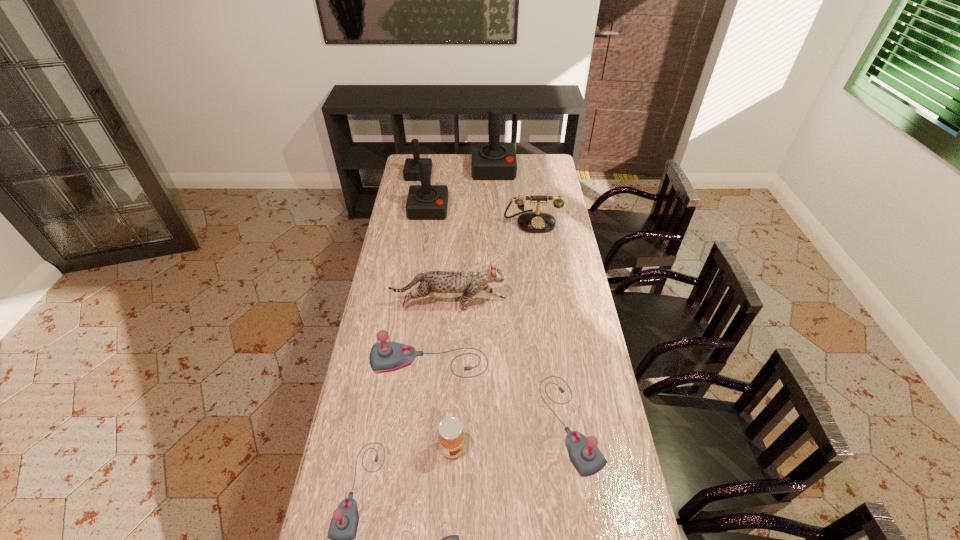
Find the location of a particular element. This screenshot has height=540, width=960. the second biggest gray joystick is located at coordinates (587, 459).

Identify the location of vacant space located 0.120m on the base of the rightmost red joystick. (494, 194).

The width and height of the screenshot is (960, 540). What are the coordinates of `blank space located 0.100m on the base of the third farthest joystick` in the screenshot? It's located at (425, 234).

Locate an element on the screen. The width and height of the screenshot is (960, 540). free space located on the base of the fifth shortest joystick is located at coordinates (413, 207).

The height and width of the screenshot is (540, 960). In order to click on vacant area situated 0.160m on the face of the sixth nearest object in this screenshot , I will do `click(547, 305)`.

Where is `vacant position located 0.260m on the dial of the black telephone`? The width and height of the screenshot is (960, 540). vacant position located 0.260m on the dial of the black telephone is located at coordinates click(539, 273).

What are the coordinates of `vacant space located 0.270m on the right of the biggest gray joystick` in the screenshot? It's located at (564, 362).

In order to click on free space located 0.120m on the front-facing side of the orange honey in this screenshot , I will do `click(504, 449)`.

In order to click on vacant region located on the left of the rightmost joystick in this screenshot , I will do `click(423, 423)`.

The image size is (960, 540). What are the coordinates of `cat at the left edge` in the screenshot? It's located at (469, 284).